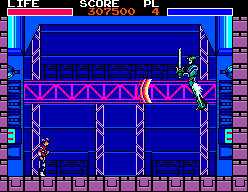
This screenshot has width=248, height=192. Identify the location of wall. (2, 107), (236, 106).